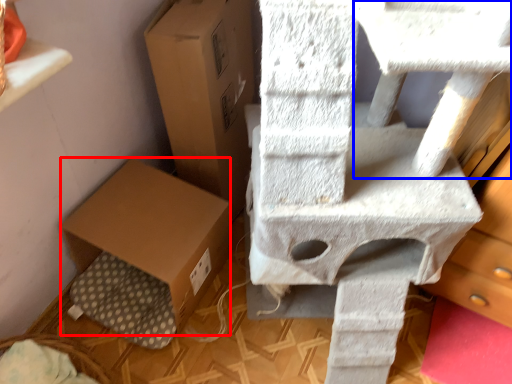
Question: Among these objects, which one is farthest to the camera, cardboard box (highlighted by a red box) or table (highlighted by a blue box)?

Choices:
 (A) cardboard box
 (B) table

Answer: (A)